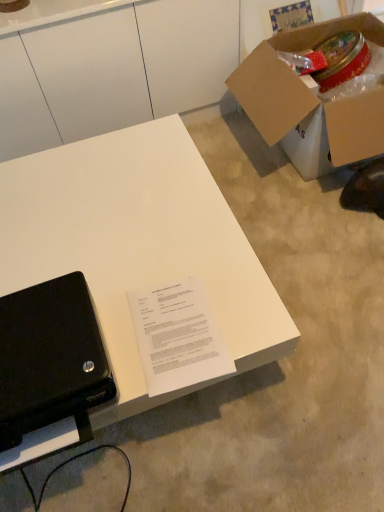
The height and width of the screenshot is (512, 384). In order to click on empty space that is ontop of black matte laptop at lower left (from a real-world perspective) in this screenshot , I will do `click(43, 343)`.